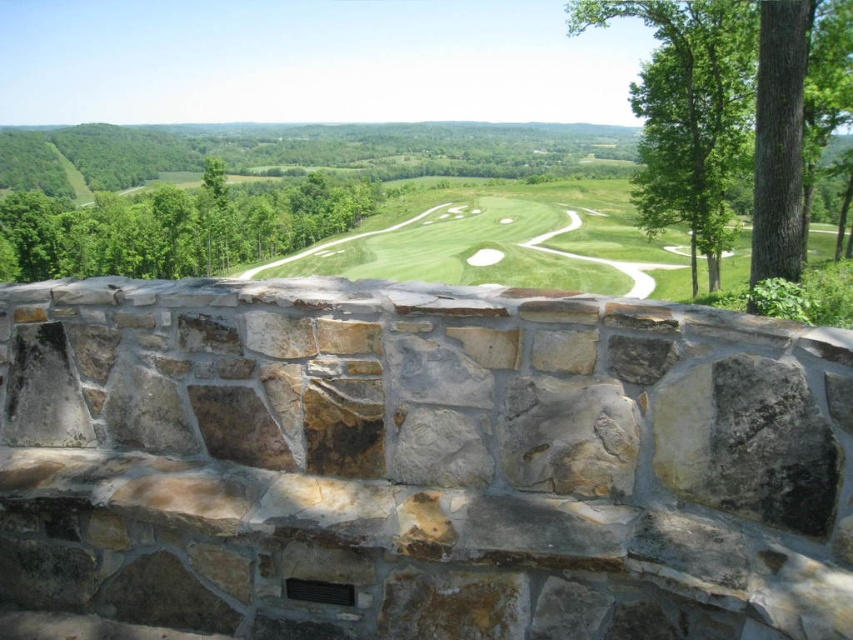
Question: Is natural stone bench at center positioned behind green leafy tree at left?

Choices:
 (A) no
 (B) yes

Answer: (A)

Question: Is the position of green grassy golf course at center less distant than that of green leafy tree at left?

Choices:
 (A) no
 (B) yes

Answer: (B)

Question: Is metallic gray vent at lower center bigger than green smooth grass hole at center?

Choices:
 (A) no
 (B) yes

Answer: (A)

Question: Estimate the real-world distances between objects in this image. Which object is closer to the natural stone bench at center?

Choices:
 (A) green smooth grass hole at center
 (B) green leafy tree at left
 (C) metallic gray vent at lower center
 (D) green grassy golf course at center

Answer: (C)

Question: Which object is farther from the camera taking this photo?

Choices:
 (A) green leafy tree at right
 (B) metallic gray vent at lower center
 (C) natural stone bench at center

Answer: (A)

Question: Estimate the real-world distances between objects in this image. Which object is closer to the green leafy tree at left?

Choices:
 (A) green leafy tree at right
 (B) green smooth grass hole at center

Answer: (B)